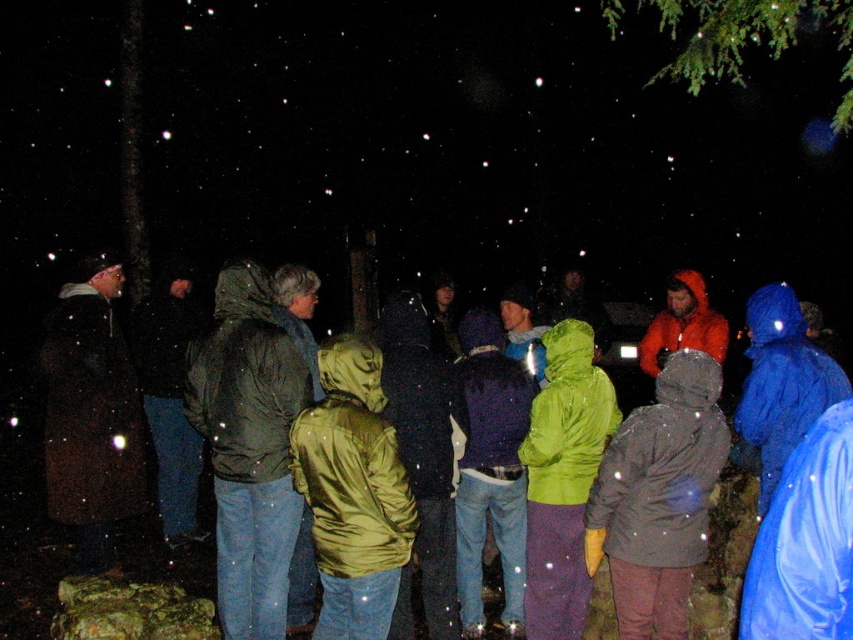
Question: Can you confirm if matte green jacket at center is smaller than orange waterproof jacket at center?

Choices:
 (A) no
 (B) yes

Answer: (B)

Question: Which object is the farthest from the green leafy branch at upper right?

Choices:
 (A) matte green jacket at center
 (B) shiny green jacket at center
 (C) dark brown jacket at left

Answer: (C)

Question: Based on their relative distances, which object is nearer to the orange waterproof jacket at center?

Choices:
 (A) green leafy branch at upper right
 (B) dark brown jacket at left
 (C) matte green jacket at center
 (D) shiny green jacket at center

Answer: (C)

Question: Which of these objects is positioned closest to the shiny green jacket at center?

Choices:
 (A) dark brown jacket at left
 (B) matte green jacket at center
 (C) orange waterproof jacket at center

Answer: (B)

Question: In this image, where is matte green jacket at center located relative to green leafy branch at upper right?

Choices:
 (A) below
 (B) above

Answer: (A)

Question: In this image, where is matte green jacket at center located relative to dark brown jacket at left?

Choices:
 (A) left
 (B) right

Answer: (B)